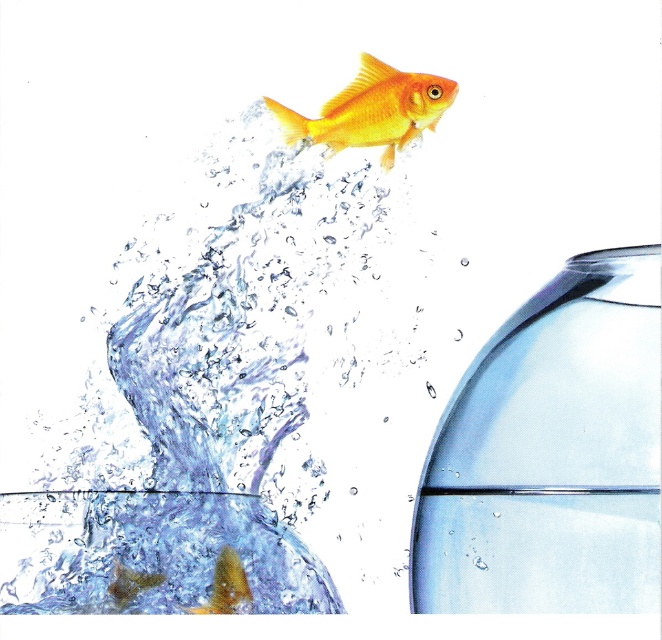
Does translucent glass water at upper center appear on the right side of shiny gold fish at upper center?

In fact, translucent glass water at upper center is to the left of shiny gold fish at upper center.

Does point (220, 420) come behind point (379, 67)?

No, it is in front of (379, 67).

Is point (177, 570) positioned behind point (389, 157)?

No, (177, 570) is closer to viewer.

You are a GUI agent. You are given a task and a screenshot of the screen. Output one action in this format:
    pyautogui.click(x=<x>, y=<y>)
    Task: Click on the translucent glass water at upper center
    This screenshot has width=662, height=640.
    Given the screenshot: What is the action you would take?
    pyautogui.click(x=222, y=385)